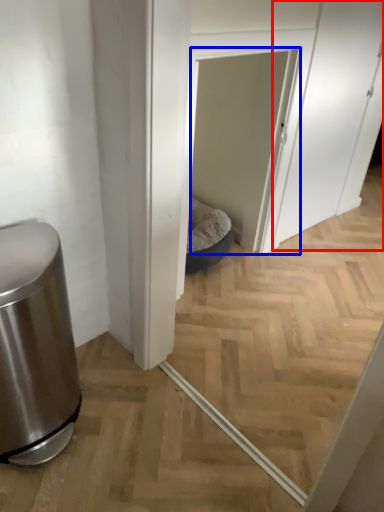
Question: Which object is further to the camera taking this photo, screen door (highlighted by a red box) or screen door (highlighted by a blue box)?

Choices:
 (A) screen door
 (B) screen door

Answer: (A)